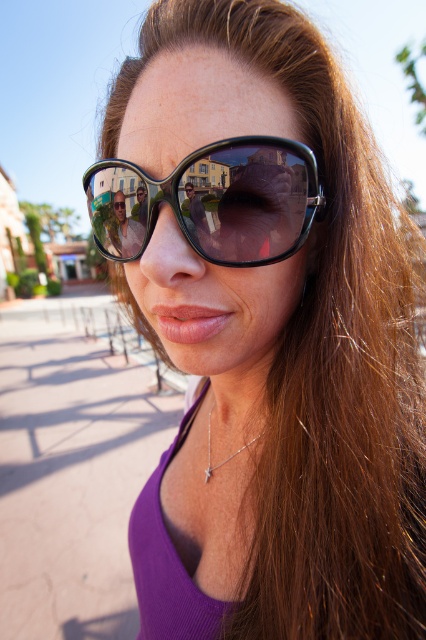
Between point (244, 177) and point (143, 237), which one is positioned behind?

Point (143, 237)

You are a GUI agent. You are given a task and a screenshot of the screen. Output one action in this format:
    pyautogui.click(x=<x>, y=<y>)
    Task: Click on the black plastic sunglasses at center
    
    Given the screenshot: What is the action you would take?
    pyautogui.click(x=212, y=202)